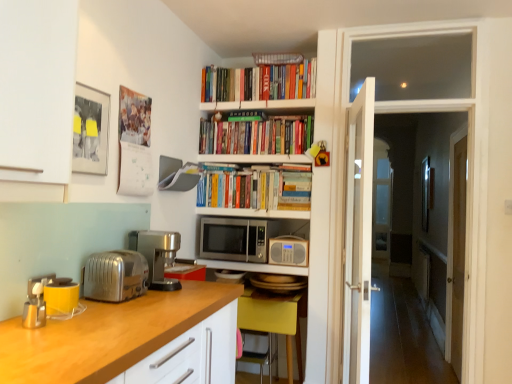
Question: Is wooden countertop at lower left bigger than satin silver coffee machine at left?

Choices:
 (A) no
 (B) yes

Answer: (B)

Question: Can you confirm if wooden countertop at lower left is shorter than satin silver coffee machine at left?

Choices:
 (A) no
 (B) yes

Answer: (A)

Question: From the image's perspective, is wooden countertop at lower left beneath satin silver coffee machine at left?

Choices:
 (A) yes
 (B) no

Answer: (A)

Question: Is wooden countertop at lower left looking in the opposite direction of satin silver coffee machine at left?

Choices:
 (A) yes
 (B) no

Answer: (B)

Question: Does wooden countertop at lower left contain satin silver coffee machine at left?

Choices:
 (A) no
 (B) yes

Answer: (A)

Question: From the image's perspective, does wooden countertop at lower left appear higher than satin silver coffee machine at left?

Choices:
 (A) no
 (B) yes

Answer: (A)

Question: Is wooden countertop at lower left to the right of transparent glass door at right from the viewer's perspective?

Choices:
 (A) no
 (B) yes

Answer: (A)

Question: Is wooden countertop at lower left to the left of transparent glass door at right from the viewer's perspective?

Choices:
 (A) yes
 (B) no

Answer: (A)

Question: Is wooden countertop at lower left not close to transparent glass door at right?

Choices:
 (A) yes
 (B) no

Answer: (A)

Question: Is wooden countertop at lower left closer to camera compared to transparent glass door at right?

Choices:
 (A) yes
 (B) no

Answer: (A)

Question: From the image's perspective, is wooden countertop at lower left below transparent glass door at right?

Choices:
 (A) no
 (B) yes

Answer: (B)

Question: Can you confirm if wooden countertop at lower left is shorter than transparent glass door at right?

Choices:
 (A) no
 (B) yes

Answer: (B)

Question: Is metallic yellow toaster at left, which is the 3th appliance from right to left, wider than satin silver coffee machine at left?

Choices:
 (A) no
 (B) yes

Answer: (A)